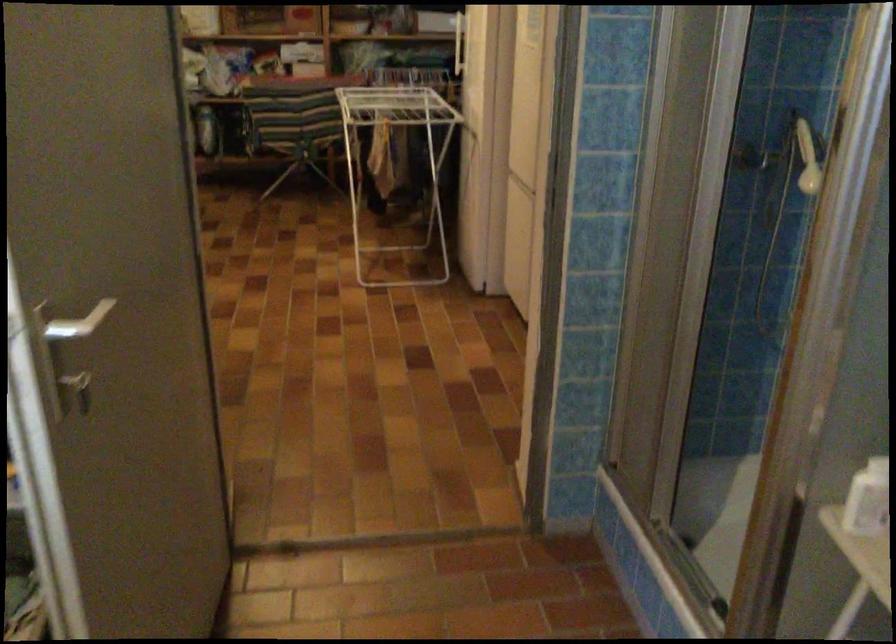
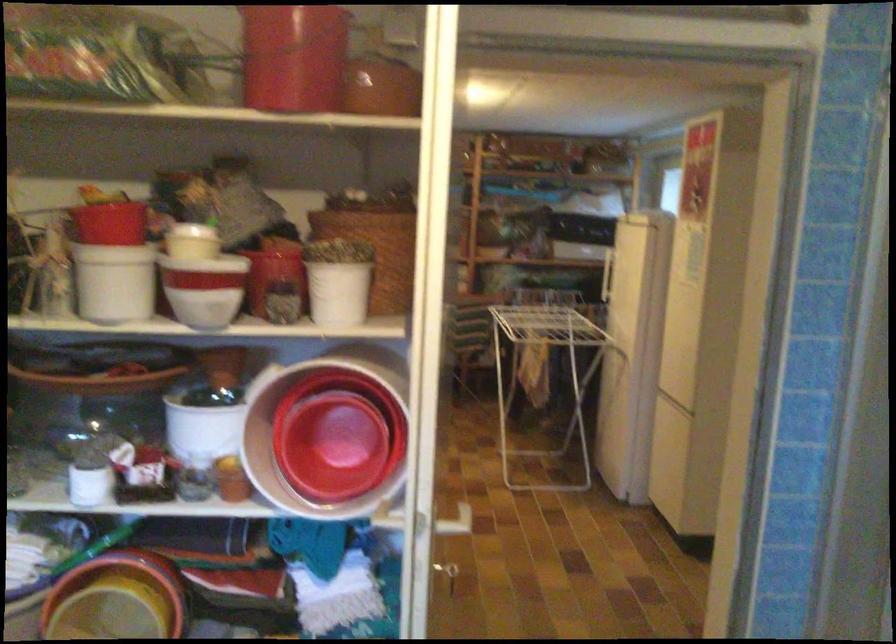
Find the pixel in the second image that matches pixel 285 384 in the first image.

(449, 574)